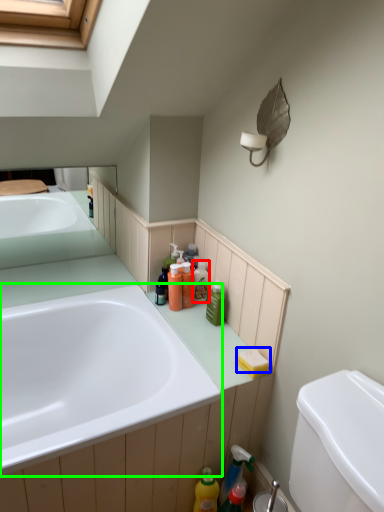
Question: Based on their relative distances, which object is nearer to toiletry (highlighted by a red box)? Choose from soap (highlighted by a blue box) and bathtub (highlighted by a green box).

Choices:
 (A) soap
 (B) bathtub

Answer: (A)